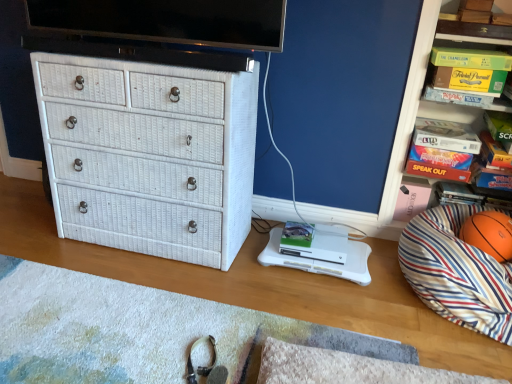
Question: Is green cardboard game at upper right surrounding white wicker chest of drawers at left?

Choices:
 (A) yes
 (B) no

Answer: (B)

Question: Would you say green cardboard game at upper right is a long distance from white wicker chest of drawers at left?

Choices:
 (A) yes
 (B) no

Answer: (A)

Question: Would you say green cardboard game at upper right is outside white wicker chest of drawers at left?

Choices:
 (A) no
 (B) yes

Answer: (B)

Question: Can you confirm if green cardboard game at upper right is smaller than white wicker chest of drawers at left?

Choices:
 (A) yes
 (B) no

Answer: (A)

Question: Can you see green cardboard game at upper right touching white wicker chest of drawers at left?

Choices:
 (A) no
 (B) yes

Answer: (A)

Question: Does point (224, 326) appear closer or farther from the camera than point (408, 87)?

Choices:
 (A) farther
 (B) closer

Answer: (B)

Question: Visually, is white textured mat at lower center positioned to the left or to the right of orange matte basketball at right?

Choices:
 (A) right
 (B) left

Answer: (B)

Question: From the image's perspective, is white textured mat at lower center positioned above or below orange matte basketball at right?

Choices:
 (A) above
 (B) below

Answer: (B)

Question: Looking at their shapes, would you say white textured mat at lower center is wider or thinner than orange matte basketball at right?

Choices:
 (A) wide
 (B) thin

Answer: (A)

Question: Considering the relative positions of striped fabric bean bag at right and orange rubber basketball at right in the image provided, is striped fabric bean bag at right to the left or to the right of orange rubber basketball at right?

Choices:
 (A) left
 (B) right

Answer: (A)

Question: Is striped fabric bean bag at right in front of or behind orange rubber basketball at right in the image?

Choices:
 (A) front
 (B) behind

Answer: (A)

Question: In terms of height, does striped fabric bean bag at right look taller or shorter compared to orange rubber basketball at right?

Choices:
 (A) short
 (B) tall

Answer: (B)

Question: Considering the positions of point (440, 266) and point (487, 248), is point (440, 266) closer or farther from the camera than point (487, 248)?

Choices:
 (A) closer
 (B) farther

Answer: (A)

Question: Is orange matte basketball at right inside or outside of white textured mat at lower center?

Choices:
 (A) outside
 (B) inside

Answer: (A)

Question: Considering the positions of orange matte basketball at right and white textured mat at lower center in the image, is orange matte basketball at right wider or thinner than white textured mat at lower center?

Choices:
 (A) thin
 (B) wide

Answer: (A)